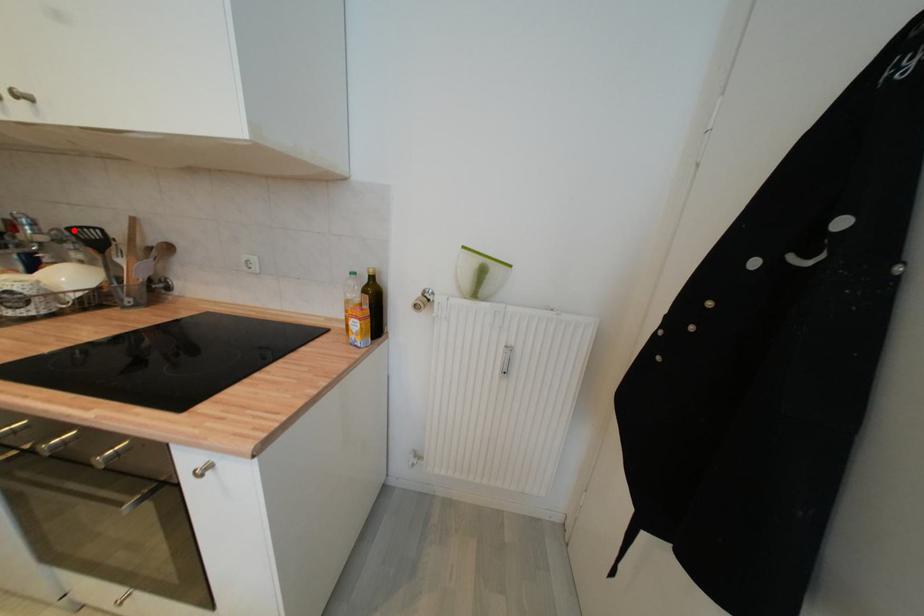
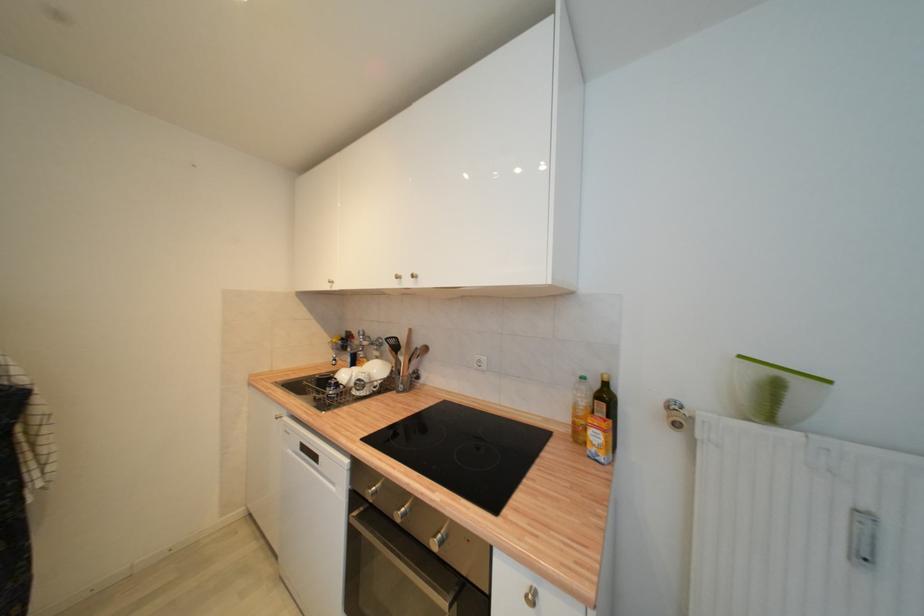
Where in the second image is the point corresponding to the highlighted location from the first image?

(392, 341)